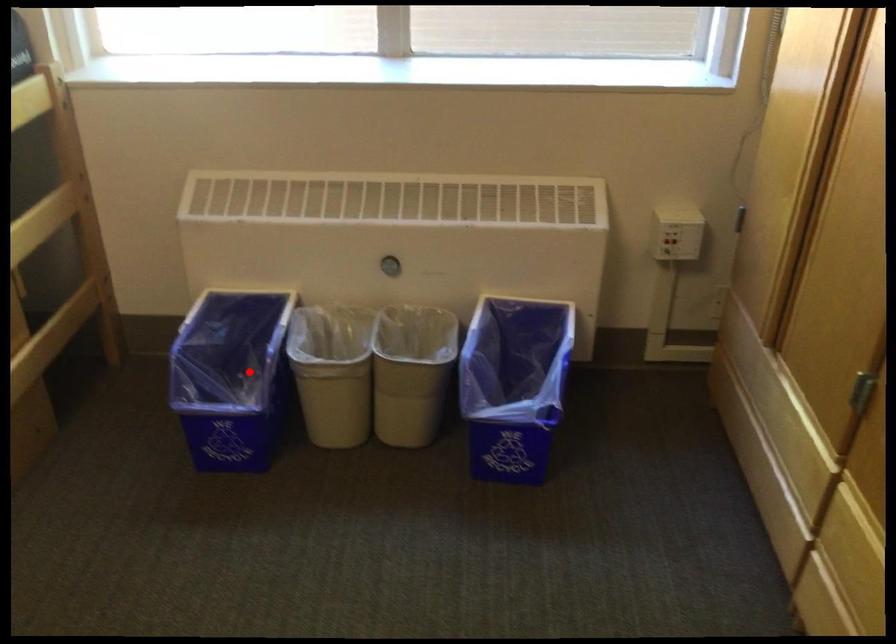
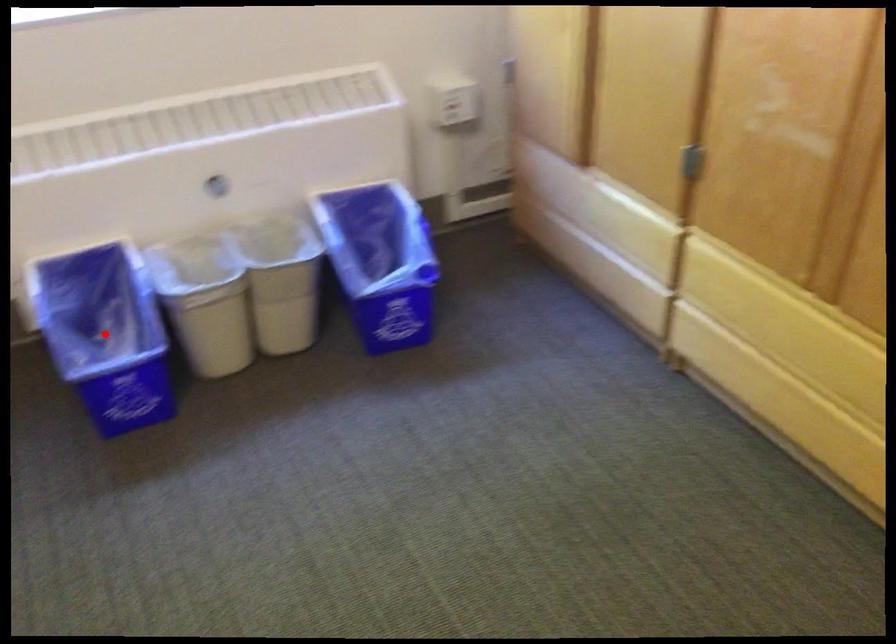
I am providing you with two images of the same scene from different viewpoints. A red point is marked on the first image and another point is marked on the second image. Are the points marked in image1 and image2 representing the same 3D position?

Yes